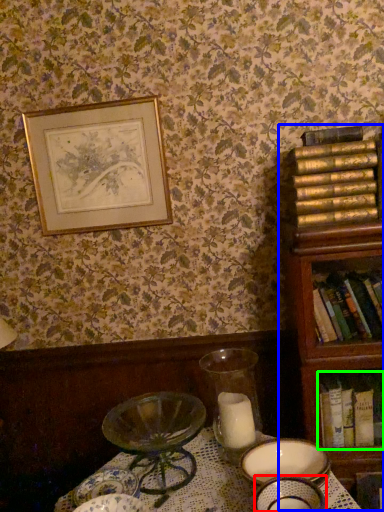
Question: Which object is the closest to the tableware (highlighted by a red box)? Choose among these: bookcase (highlighted by a blue box) or book (highlighted by a green box).

Choices:
 (A) bookcase
 (B) book

Answer: (B)